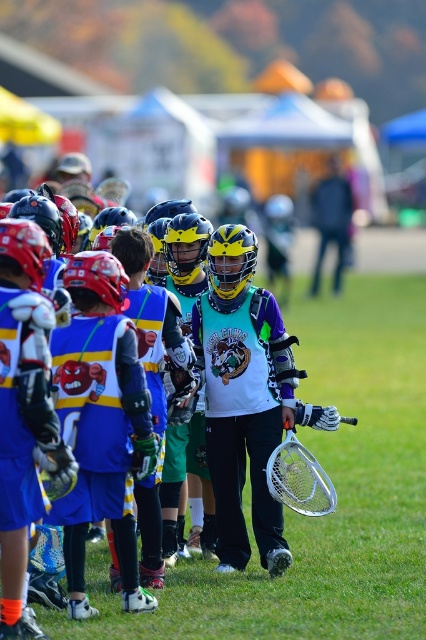
Question: Does matte blue jersey at center have a lesser width compared to matte yellow helmet at center?

Choices:
 (A) yes
 (B) no

Answer: (B)

Question: Which object appears closest to the camera in this image?

Choices:
 (A) matte yellow helmet at center
 (B) matte blue jersey at center

Answer: (B)

Question: Which point is farther to the camera?

Choices:
 (A) matte blue jersey at center
 (B) matte yellow helmet at center

Answer: (B)

Question: Among these objects, which one is nearest to the camera?

Choices:
 (A) matte yellow helmet at center
 (B) matte blue jersey at center

Answer: (B)

Question: From the image, what is the correct spatial relationship of matte blue jersey at center in relation to matte yellow helmet at center?

Choices:
 (A) left
 (B) right

Answer: (A)

Question: From the image, what is the correct spatial relationship of matte blue jersey at center in relation to matte yellow helmet at center?

Choices:
 (A) left
 (B) right

Answer: (A)